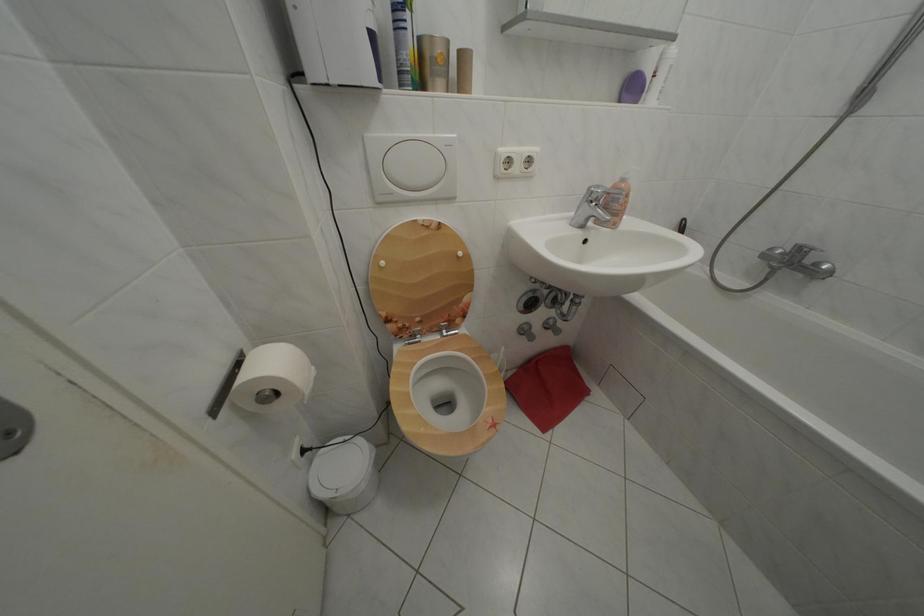
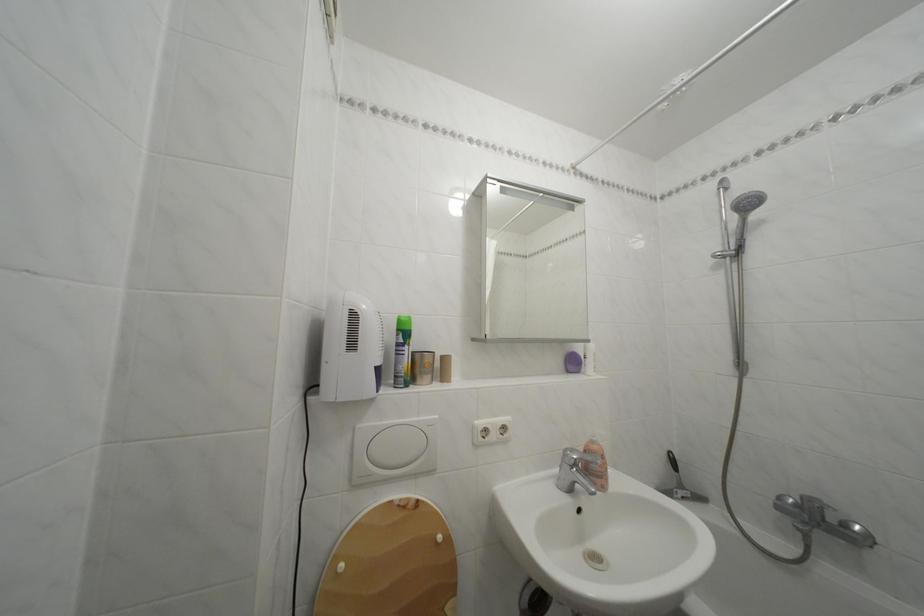
Locate, in the second image, the point that corresponds to point (631, 187) in the first image.

(602, 448)